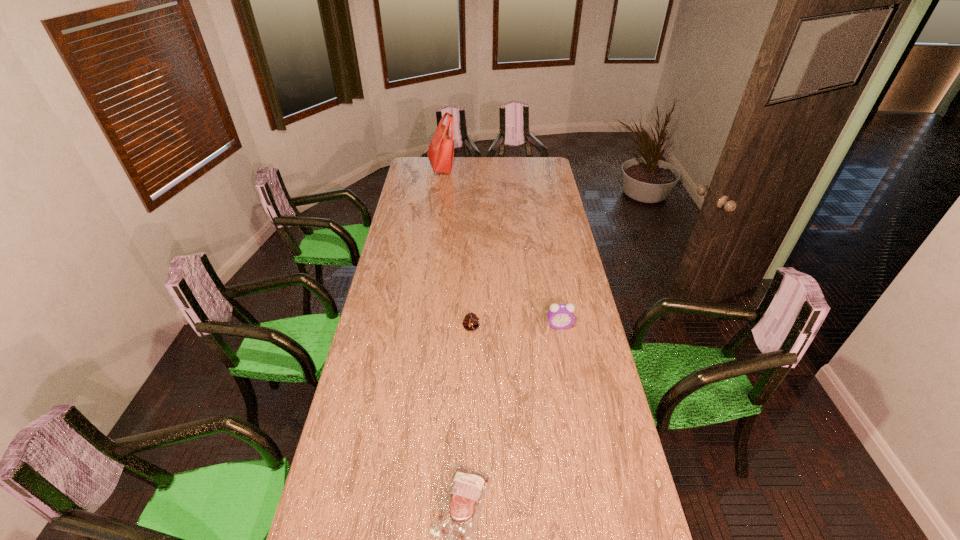
I want to click on object at the right edge, so click(x=560, y=316).

This screenshot has width=960, height=540. I want to click on object at the far left corner, so click(441, 149).

Locate an element on the screen. Image resolution: width=960 pixels, height=540 pixels. vacant space at the left edge of the desktop is located at coordinates (390, 291).

Find the location of a particular element. The height and width of the screenshot is (540, 960). vacant point at the right edge is located at coordinates (594, 489).

Where is `free space at the far left corner`? The height and width of the screenshot is (540, 960). free space at the far left corner is located at coordinates (409, 163).

In order to click on vacant space that is in between the pinecone and the tallest object in this screenshot , I will do `click(456, 248)`.

This screenshot has height=540, width=960. In order to click on free space between the leftmost object and the third shortest object in this screenshot , I will do `click(500, 246)`.

Where is `free space between the second tallest object and the second shortest object`? This screenshot has width=960, height=540. free space between the second tallest object and the second shortest object is located at coordinates (516, 327).

Find the location of a particular element. This screenshot has width=960, height=540. free space between the tallest object and the second shortest object is located at coordinates (456, 248).

In order to click on free space between the third tallest object and the handbag in this screenshot , I will do `click(456, 248)`.